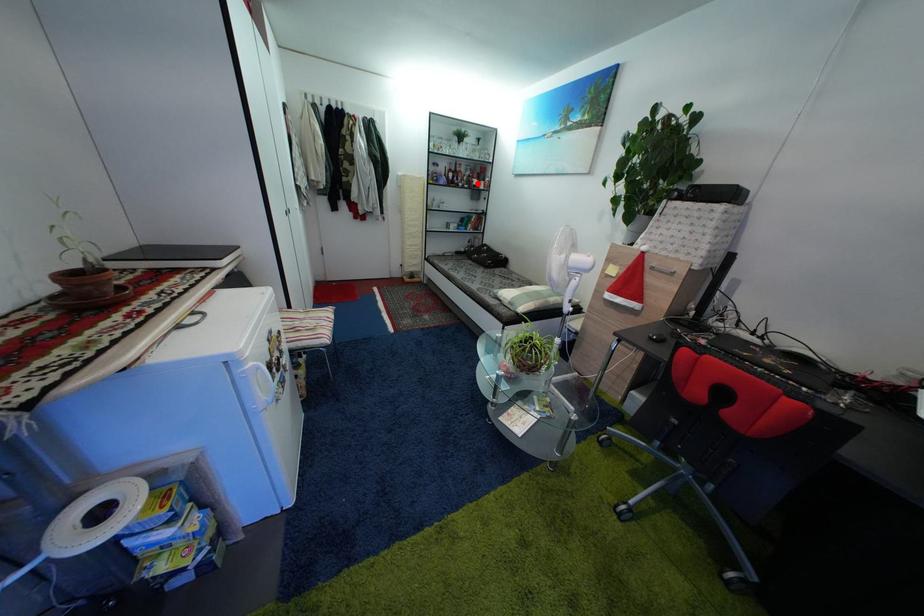
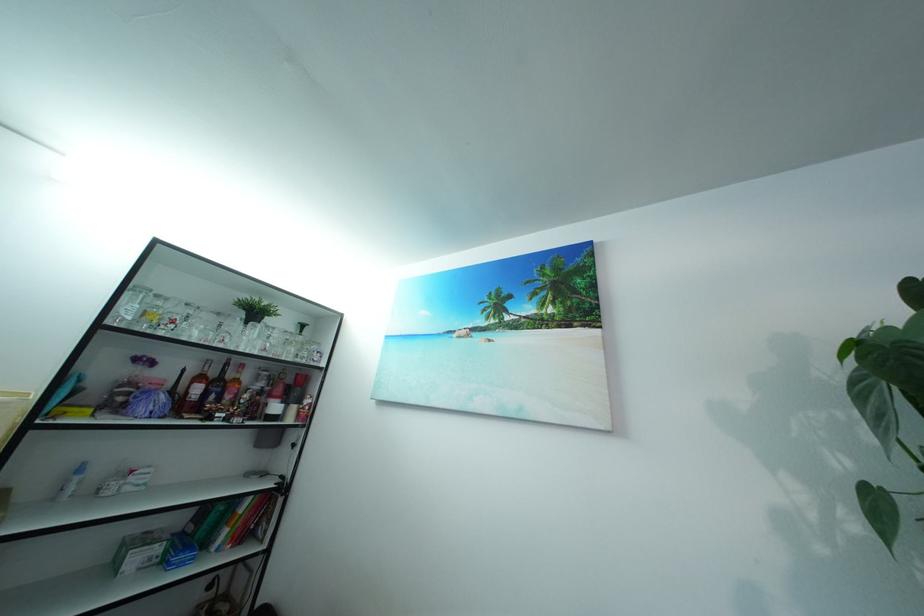
Question: A red point is marked in image1. In image2, is the corresponding 3D point closer to the camera or farther? Reply with the corresponding letter.

Choices:
 (A) The corresponding 3D point is closer.
 (B) The corresponding 3D point is farther.

Answer: (B)